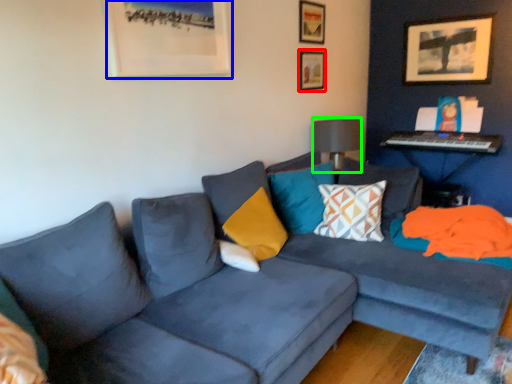
Question: Which object is positioned closest to picture frame (highlighted by a red box)? Select from picture frame (highlighted by a blue box) and lamp (highlighted by a green box).

Choices:
 (A) picture frame
 (B) lamp

Answer: (B)